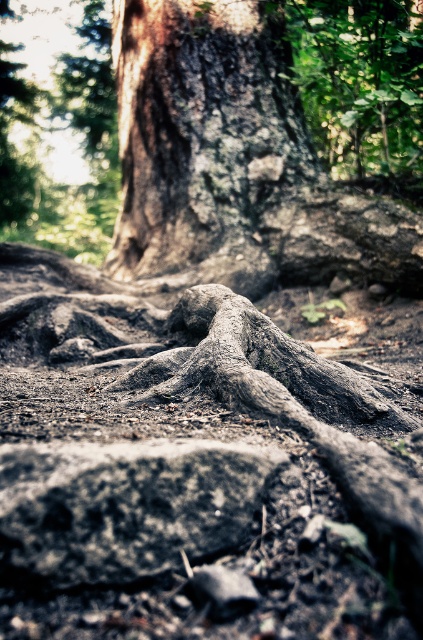
You are a botanist examining the tree in the forest. You need to determine which part, the dark brown rough bark at center or the gray textured roots at center, has a greater width. Based on the image, which one is wider?

The dark brown rough bark at center might be wider than gray textured roots at center according to the description.

You are a hiker who wants to place a small backpack between the dark brown rough bark at center and the smooth gray rock at center. Based on their positions, which object should you place the backpack closer to if you want it to be on the left side of the rock?

You should place the backpack closer to the dark brown rough bark at center because it is already on the left side of the smooth gray rock at center.